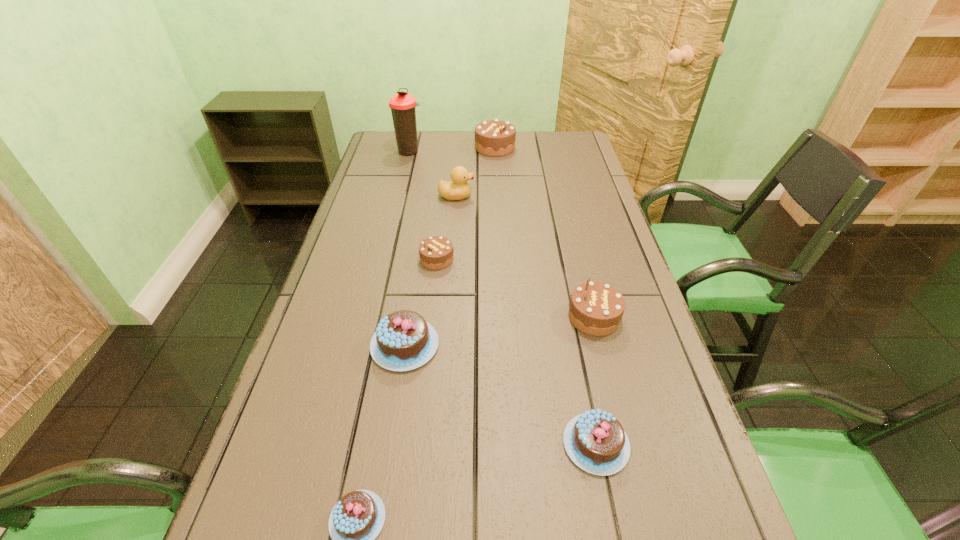
Identify the location of vacant point located between the fourth chocolate cake from left to right and the smallest brown chocolate cake. The image size is (960, 540). (466, 204).

At what (x,y) coordinates should I click in order to perform the action: click on blank region between the nearest brown chocolate cake and the duckling. Please return your answer as a coordinate pair (x, y). The image size is (960, 540). Looking at the image, I should click on (525, 256).

This screenshot has height=540, width=960. Identify the location of unoccupied position between the tallest object and the duckling. (433, 174).

In order to click on empty space between the second farthest pink chocolate cake and the second biggest brown chocolate cake in this screenshot , I will do `click(595, 381)`.

The height and width of the screenshot is (540, 960). Find the location of `free spot between the leftmost brown chocolate cake and the second brown chocolate cake from right to left`. free spot between the leftmost brown chocolate cake and the second brown chocolate cake from right to left is located at coordinates (466, 204).

Locate an element on the screen. Image resolution: width=960 pixels, height=540 pixels. free point between the smallest brown chocolate cake and the thermos bottle is located at coordinates (423, 205).

The width and height of the screenshot is (960, 540). What are the coordinates of `empty space between the tallest object and the tallest chocolate cake` in the screenshot? It's located at (452, 150).

The image size is (960, 540). Find the location of `blank region between the biggest pink chocolate cake and the second nearest brown chocolate cake`. blank region between the biggest pink chocolate cake and the second nearest brown chocolate cake is located at coordinates click(x=420, y=302).

This screenshot has width=960, height=540. I want to click on object that is the second closest to the second farthest pink chocolate cake, so click(403, 341).

Locate an element on the screen. Image resolution: width=960 pixels, height=540 pixels. object that is the second closest to the biggest brown chocolate cake is located at coordinates point(458,189).